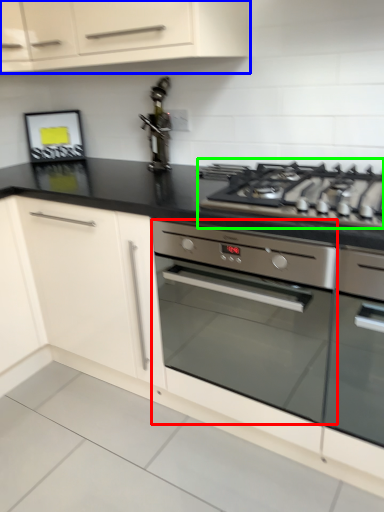
Question: Which object is positioned closest to home appliance (highlighted by a red box)? Select from cabinetry (highlighted by a blue box) and gas stove (highlighted by a green box).

Choices:
 (A) cabinetry
 (B) gas stove

Answer: (B)